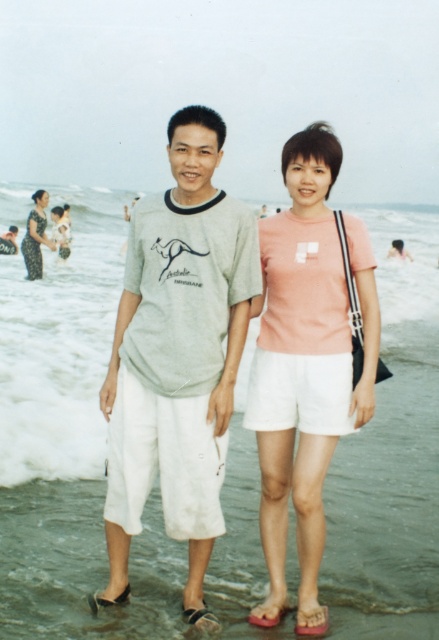
You are standing at the beach and want to reach a specific point marked at coordinates point (118,561). If you can walk 3 meters per minute, how long will it take you to reach that point?

The point (118,561) is 4.06 meters away from the viewer. At a walking speed of 3 meters per minute, it would take approximately 1.35 minutes to reach the point.